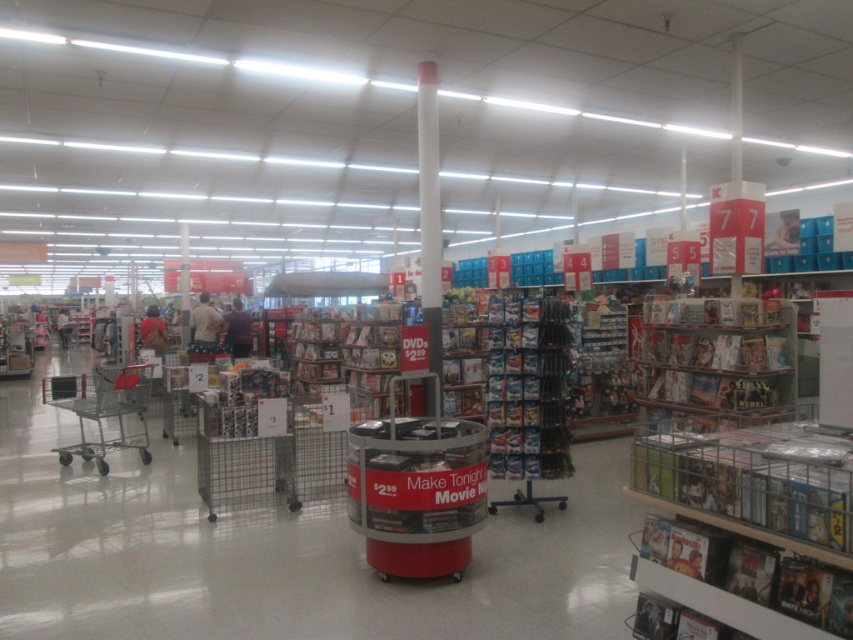
Question: Estimate the real-world distances between objects in this image. Which object is farther from the metallic silver shelves at right?

Choices:
 (A) silver metallic shopping cart at left
 (B) metallic silver shopping cart at center

Answer: (A)

Question: Does metallic silver shopping cart at center appear on the left side of silver metallic shopping cart at left?

Choices:
 (A) no
 (B) yes

Answer: (A)

Question: Considering the real-world distances, which object is closest to the metallic silver shopping cart at center?

Choices:
 (A) metallic silver shelves at right
 (B) silver metallic shopping cart at left

Answer: (A)

Question: Is metallic silver shopping cart at center in front of metallic silver shelves at right?

Choices:
 (A) no
 (B) yes

Answer: (B)

Question: Which of the following is the closest to the observer?

Choices:
 (A) metallic silver shelves at right
 (B) silver metallic shopping cart at left
 (C) metallic silver shopping cart at center

Answer: (C)

Question: From the image, what is the correct spatial relationship of metallic silver shopping cart at center in relation to silver metallic shopping cart at left?

Choices:
 (A) below
 (B) above

Answer: (B)